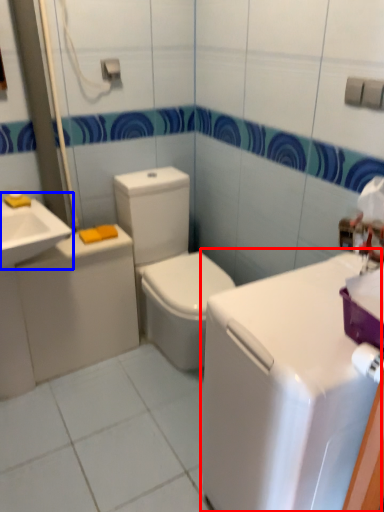
Question: Among these objects, which one is farthest to the camera, counter top (highlighted by a red box) or sink (highlighted by a blue box)?

Choices:
 (A) counter top
 (B) sink

Answer: (B)